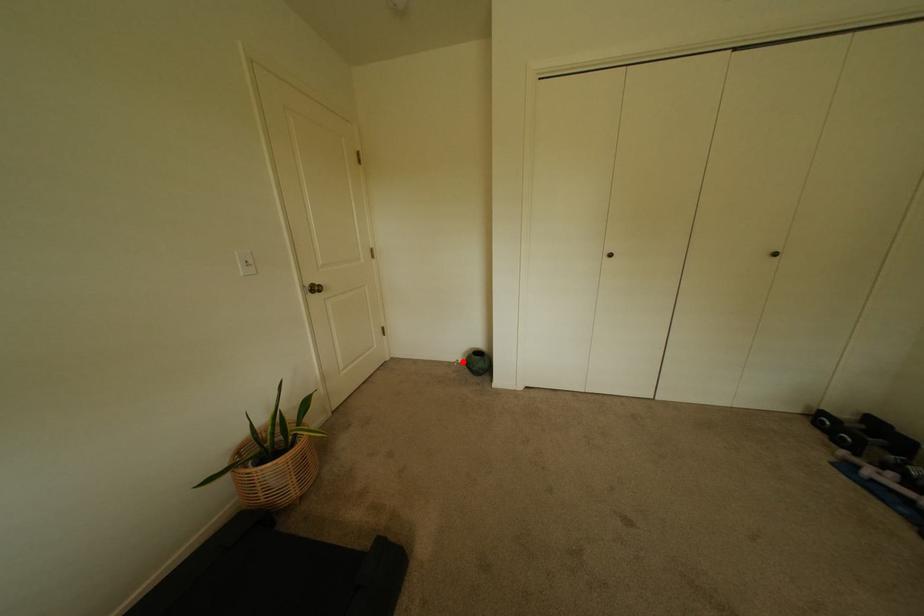
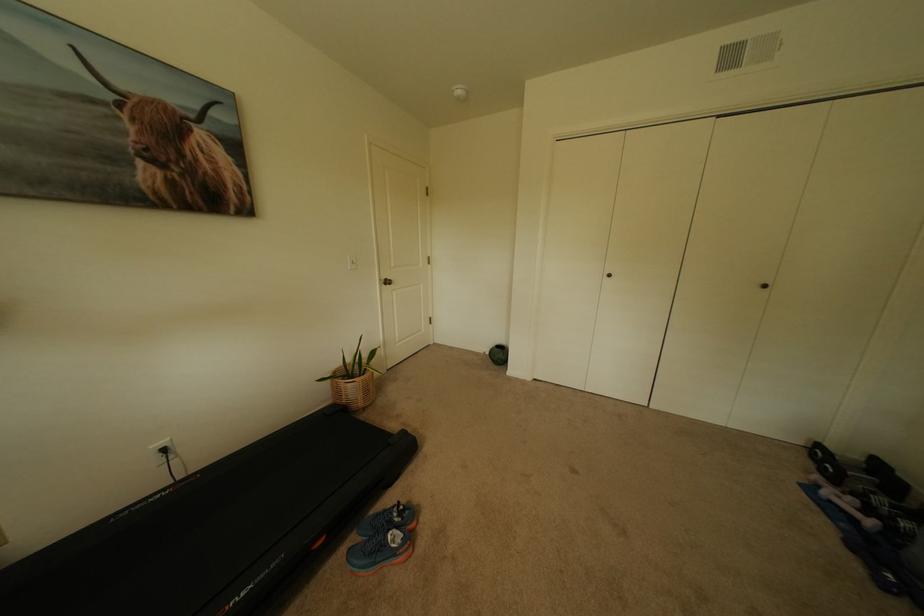
Question: I am providing you with two images of the same scene from different viewpoints. Image1 has a red point marked. In image2, the corresponding 3D location appears at what relative position? Reply with the corresponding letter.

Choices:
 (A) Closer
 (B) Farther

Answer: (A)